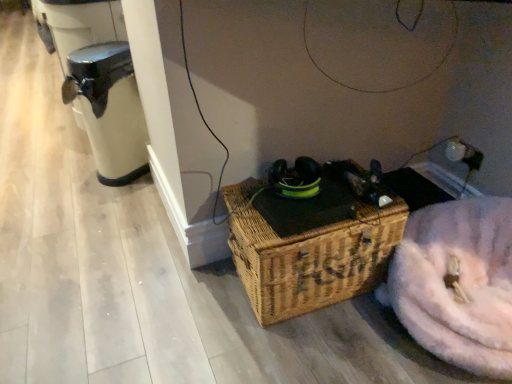
Where is `vacant space to the left of woven brown picnic basket at center`? This screenshot has height=384, width=512. vacant space to the left of woven brown picnic basket at center is located at coordinates (182, 316).